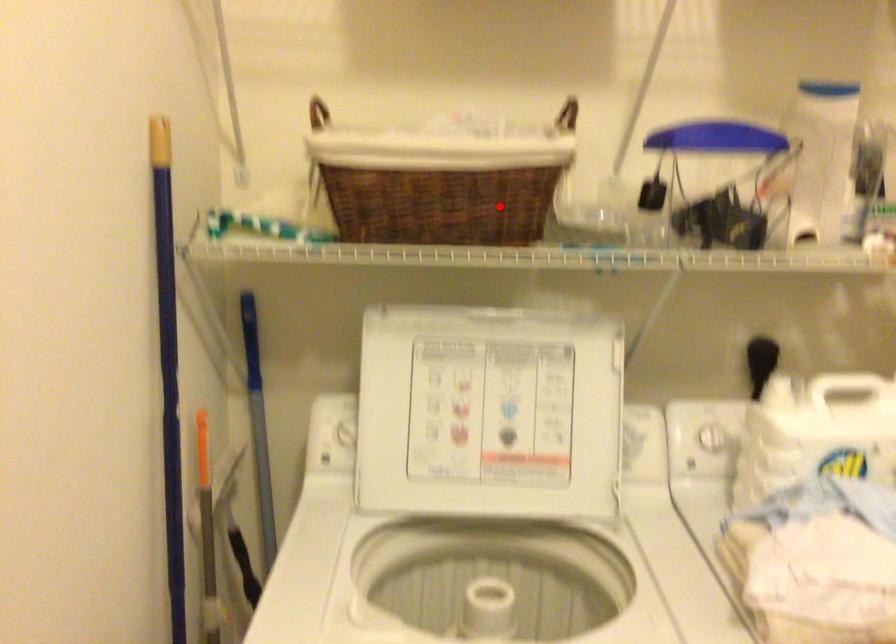
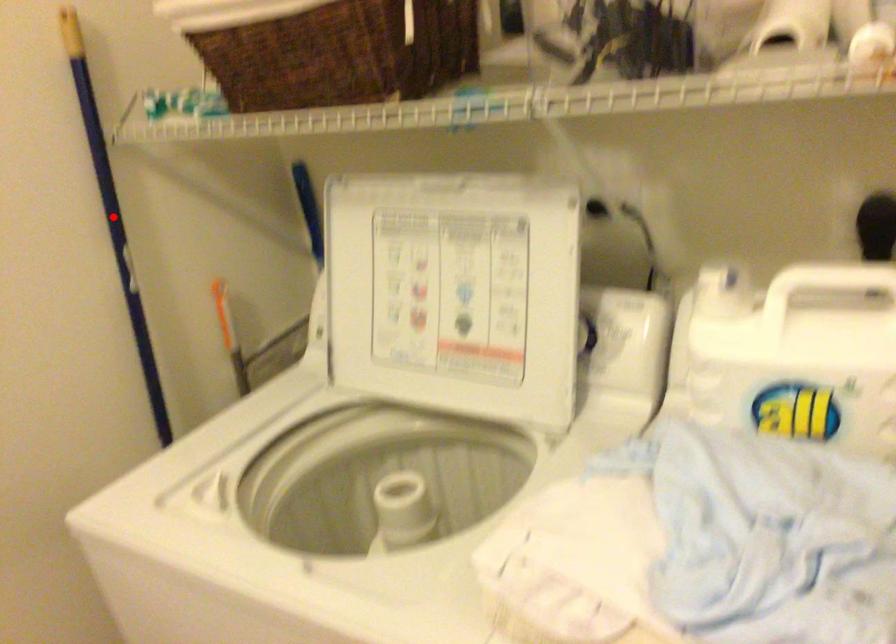
I am providing you with two images of the same scene from different viewpoints. A red point is marked on the first image and another point is marked on the second image. Are the points marked in image1 and image2 representing the same 3D position?

No